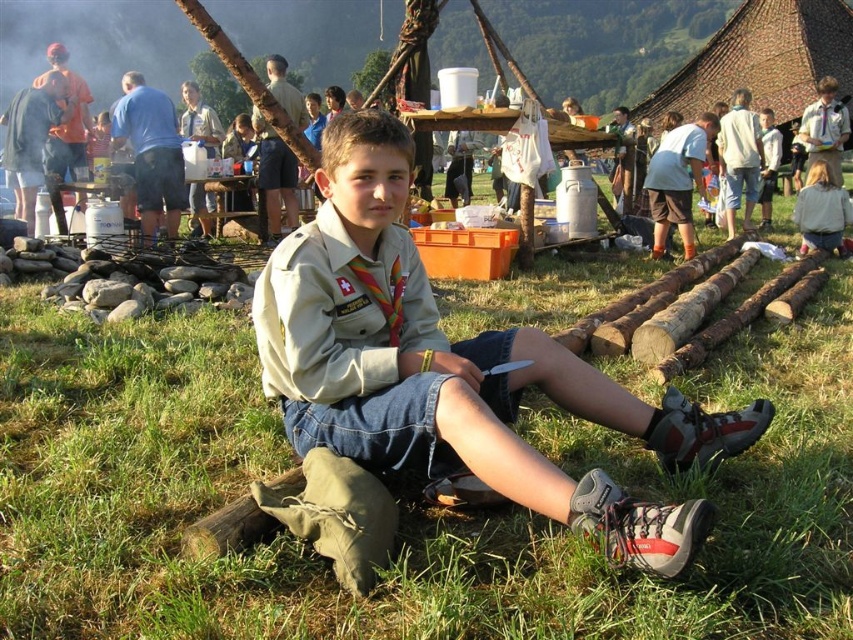
Which of these two, tan uniform at center or light brown hair at upper right, stands shorter?

light brown hair at upper right

Which is more to the left, tan uniform at center or light brown hair at upper right?

Positioned to the left is tan uniform at center.

Does point (434, 417) come closer to viewer compared to point (804, 218)?

Yes.

You are a GUI agent. You are given a task and a screenshot of the screen. Output one action in this format:
    pyautogui.click(x=<x>, y=<y>)
    Task: Click on the tan uniform at center
    This screenshot has width=853, height=640.
    Given the screenshot: What is the action you would take?
    pyautogui.click(x=453, y=368)

Measure the distance between green grass at center and light brown hair at upper right.

They are 30.28 feet apart.

Does green grass at center have a lesser width compared to light brown hair at upper right?

A: Indeed, green grass at center has a lesser width compared to light brown hair at upper right.

Between point (538, 401) and point (809, 232), which one is positioned in front?

Point (538, 401) is in front.

Locate an element on the screen. The image size is (853, 640). green grass at center is located at coordinates (401, 508).

Who is lower down, green grass at center or tan uniform at center?

green grass at center is below.

Is point (837, 572) positioned after point (332, 273)?

No, (837, 572) is closer to viewer.

Identify the location of green grass at center. This screenshot has width=853, height=640. (401, 508).